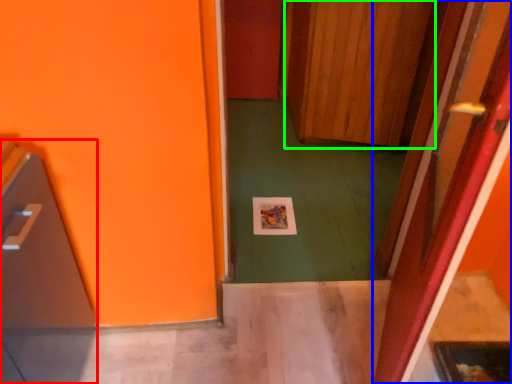
Question: Based on their relative distances, which object is nearer to appliance (highlighted by a red box)? Choose from door (highlighted by a blue box) and door (highlighted by a green box).

Choices:
 (A) door
 (B) door

Answer: (A)